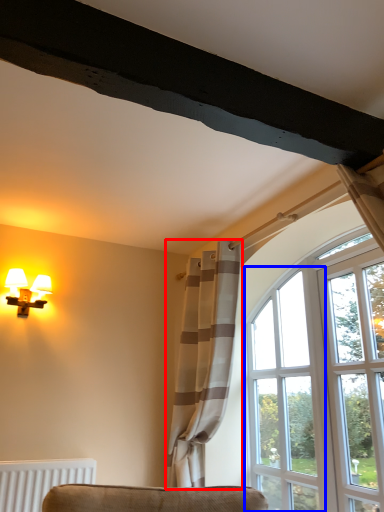
Question: Which object appears closest to the camera in this image, curtain (highlighted by a red box) or window (highlighted by a blue box)?

Choices:
 (A) curtain
 (B) window

Answer: (A)